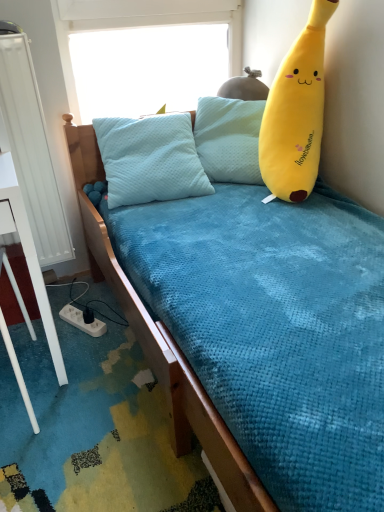
Locate an element on the screen. vacant space in front of white plastic power outlet at lower left is located at coordinates (78, 359).